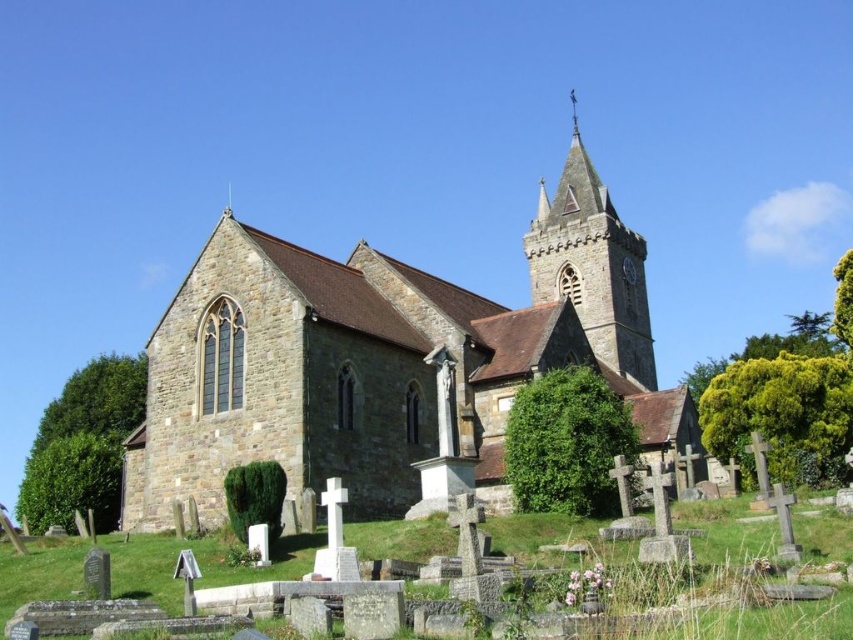
You are standing in front of the brown stone church at center and looking towards the stone steeple at upper center. Which structure appears larger in your view?

The brown stone church at center appears larger in your view because it is bigger than the stone steeple at upper center.

You are a photographer standing in front of the brown stone church at center and the stone steeple at upper center. You want to capture a wide shot that includes both structures. Based on their sizes, which one should you frame first to ensure both are in the shot?

The brown stone church at center might be wider than the stone steeple at upper center, so you should frame the brown stone church at center first to ensure both are included in the shot.

You are standing at the point marked as point (386, 360) in the image. What is the nearest object to you?

The nearest object to you is the brown stone church at center, as the point (386, 360) indicates its location.